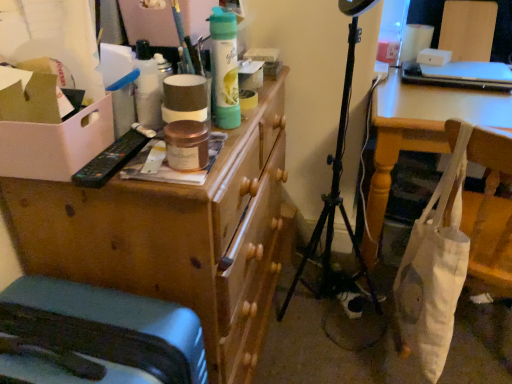
Where is `free space above matte gray suitcase at lower left (from a real-world perspective)`? Image resolution: width=512 pixels, height=384 pixels. free space above matte gray suitcase at lower left (from a real-world perspective) is located at coordinates (81, 327).